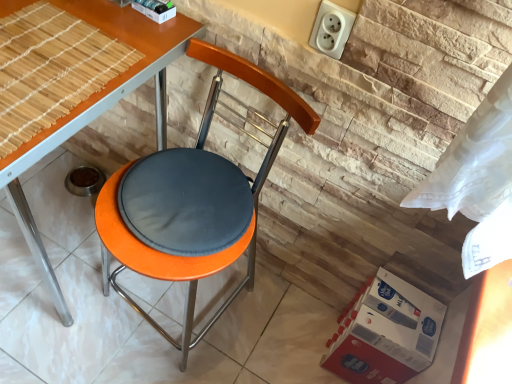
Locate an element on the screen. This screenshot has height=384, width=512. empty space that is ontop of orange matte stool at center (from a real-world perspective) is located at coordinates (185, 196).